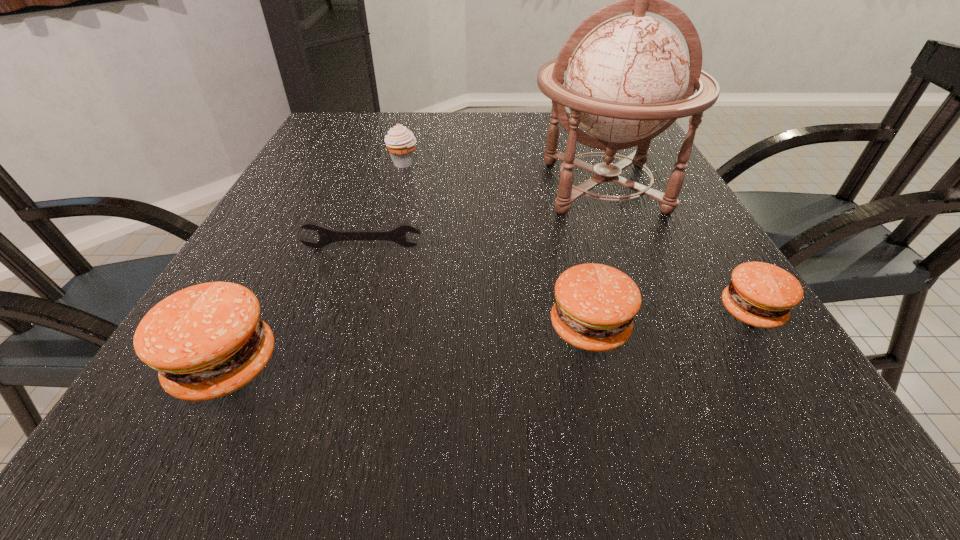
Image resolution: width=960 pixels, height=540 pixels. In order to click on empty space that is in between the fifth tallest object and the globe in this screenshot , I will do `click(677, 249)`.

Locate an element on the screen. The height and width of the screenshot is (540, 960). vacant area that lies between the muffin and the second patty from left to right is located at coordinates (496, 246).

What are the coordinates of `vacant area that lies between the second patty from right to left and the tallest object` in the screenshot? It's located at (596, 257).

This screenshot has width=960, height=540. What are the coordinates of `free spot between the fourth nearest object and the shortest patty` in the screenshot? It's located at (557, 279).

Where is `vacant space in between the second patty from left to right and the tallest patty`? This screenshot has height=540, width=960. vacant space in between the second patty from left to right and the tallest patty is located at coordinates (407, 347).

Find the location of `free space between the fifth tallest object and the globe`. free space between the fifth tallest object and the globe is located at coordinates (677, 249).

Find the location of a particular element. This screenshot has height=540, width=960. the third closest object to the muffin is located at coordinates (206, 341).

Where is `object that can be found as the fifth closest to the muffin`? This screenshot has height=540, width=960. object that can be found as the fifth closest to the muffin is located at coordinates (762, 295).

Select which patty appears as the closest to the leftmost patty. Please provide its 2D coordinates. Your answer should be formatted as a tuple, i.e. [(x, y)], where the tuple contains the x and y coordinates of a point satisfying the conditions above.

[(595, 304)]

Point out which patty is positioned as the third nearest to the wrench. Please provide its 2D coordinates. Your answer should be formatted as a tuple, i.e. [(x, y)], where the tuple contains the x and y coordinates of a point satisfying the conditions above.

[(762, 295)]